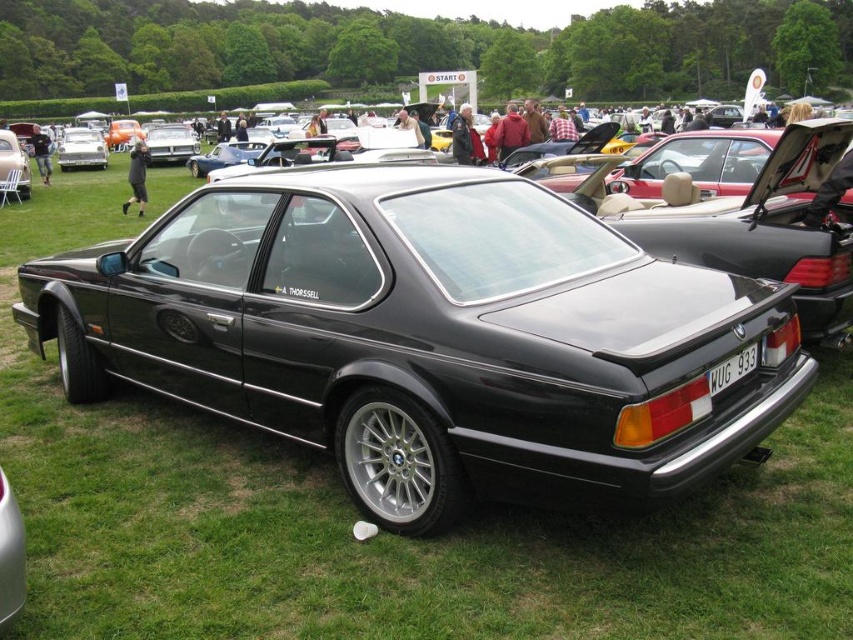
You are a photographer at the car exhibition. You want to take a photo of the metallic silver car at center. The camera you are using has a focal length of 50mm. If you want to capture the entire car in the frame, what is the minimum distance you should stand from the car?

The metallic silver car at center is positioned at point (80, 148). To capture the entire car in the frame with a 50mm lens, the minimum distance should be calculated using the formula distance equals focal length multiplied by the car length divided by the sensor size. However, without knowing the car length or sensor size, an exact distance can not be determined. Please provide additional details for an accurate calculation.

You are a photographer at the car exhibition and need to capture a clear shot of the white plastic license plate at center without the matte black car at center blocking it. How should you position yourself relative to the car?

The white plastic license plate at center is behind the matte black car at center, so you should position yourself behind the matte black car at center to capture the license plate without obstruction.

You are standing in front of the black E24 BMW at the car show. You see two points marked on the car. The first point is at coordinate point (1, 152) and the second is at point (732, 384). Which point is closer to you?

Point (1, 152) is closer to you because it is further to the viewer than point (732, 384).